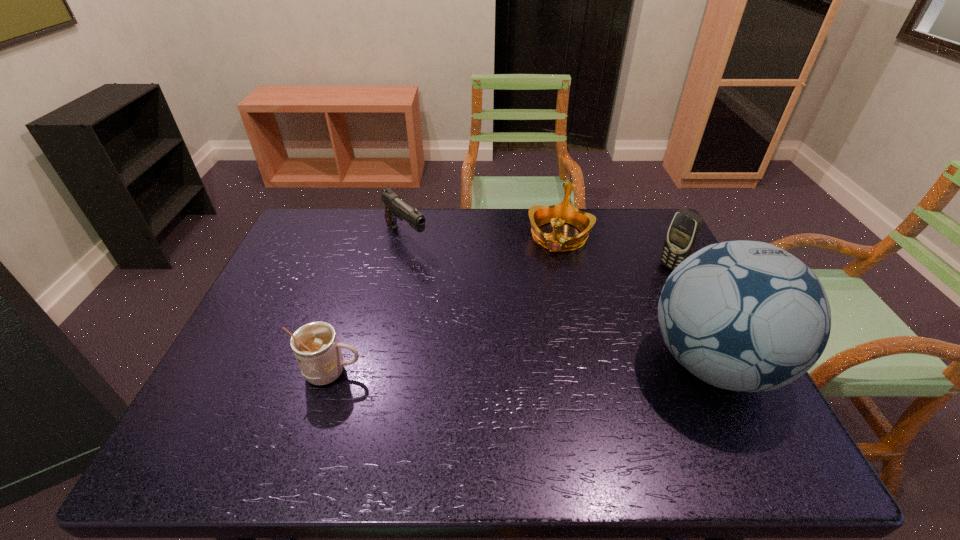
Identify the location of free spot between the tallest object and the cup. The height and width of the screenshot is (540, 960). (522, 368).

You are a GUI agent. You are given a task and a screenshot of the screen. Output one action in this format:
    pyautogui.click(x=<x>, y=<y>)
    Task: Click on the free point between the tallest object and the cup
    The width and height of the screenshot is (960, 540).
    Given the screenshot: What is the action you would take?
    pyautogui.click(x=522, y=368)

Identify the location of free spot between the cup and the gun. This screenshot has height=540, width=960. (369, 305).

Locate an element on the screen. free spot between the gun and the fourth shortest object is located at coordinates (539, 252).

Locate an element on the screen. The height and width of the screenshot is (540, 960). empty location between the gun and the tallest object is located at coordinates tap(560, 300).

Identify which object is located as the second nearest to the fourth shortest object. Please provide its 2D coordinates. Your answer should be formatted as a tuple, i.e. [(x, y)], where the tuple contains the x and y coordinates of a point satisfying the conditions above.

[(539, 215)]

Image resolution: width=960 pixels, height=540 pixels. In order to click on object that is the second closest to the gun in this screenshot , I will do `click(315, 345)`.

Locate an element on the screen. The height and width of the screenshot is (540, 960). vacant point that satisfies the following two spatial constraints: 1. on the front side of the tallest object; 2. on the side with brand of the tiara is located at coordinates (588, 363).